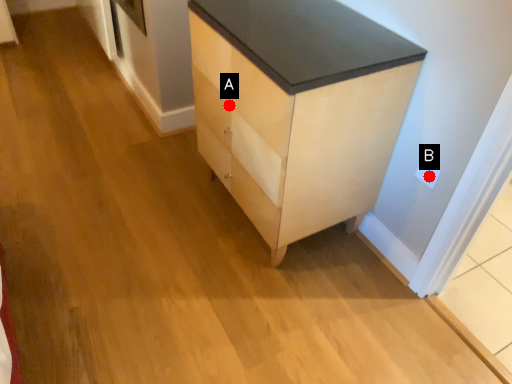
Question: Two points are circled on the image, labeled by A and B beside each circle. Which point appears farthest from the camera in this image?

Choices:
 (A) A is further
 (B) B is further

Answer: (A)